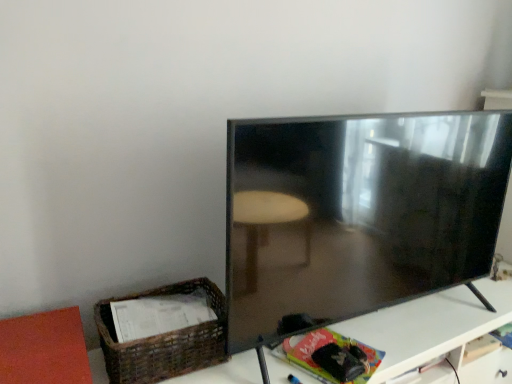
Question: Should I look upward or downward to see white glossy table at lower right?

Choices:
 (A) down
 (B) up

Answer: (A)

Question: Does white glossy table at lower right touch woven brown basket at lower left?

Choices:
 (A) yes
 (B) no

Answer: (B)

Question: Is woven brown basket at lower left a part of white glossy table at lower right?

Choices:
 (A) yes
 (B) no

Answer: (B)

Question: Considering the relative sizes of white glossy table at lower right and woven brown basket at lower left in the image provided, is white glossy table at lower right smaller than woven brown basket at lower left?

Choices:
 (A) yes
 (B) no

Answer: (B)

Question: Does white glossy table at lower right have a greater width compared to woven brown basket at lower left?

Choices:
 (A) no
 (B) yes

Answer: (B)

Question: Can you confirm if white glossy table at lower right is bigger than woven brown basket at lower left?

Choices:
 (A) yes
 (B) no

Answer: (A)

Question: Considering the relative sizes of white glossy table at lower right and woven brown basket at lower left in the image provided, is white glossy table at lower right taller than woven brown basket at lower left?

Choices:
 (A) no
 (B) yes

Answer: (B)

Question: Is the depth of matte black tv at right greater than that of white glossy table at lower right?

Choices:
 (A) no
 (B) yes

Answer: (A)

Question: Considering the relative sizes of matte black tv at right and white glossy table at lower right in the image provided, is matte black tv at right bigger than white glossy table at lower right?

Choices:
 (A) no
 (B) yes

Answer: (A)

Question: From a real-world perspective, is matte black tv at right under white glossy table at lower right?

Choices:
 (A) yes
 (B) no

Answer: (B)

Question: From a real-world perspective, is matte black tv at right located higher than white glossy table at lower right?

Choices:
 (A) yes
 (B) no

Answer: (A)

Question: Is matte black tv at right not within white glossy table at lower right?

Choices:
 (A) no
 (B) yes

Answer: (B)

Question: From the image's perspective, is matte black tv at right on white glossy table at lower right?

Choices:
 (A) no
 (B) yes

Answer: (B)

Question: From the image's perspective, does woven brown basket at lower left appear lower than white glossy table at lower right?

Choices:
 (A) no
 (B) yes

Answer: (A)